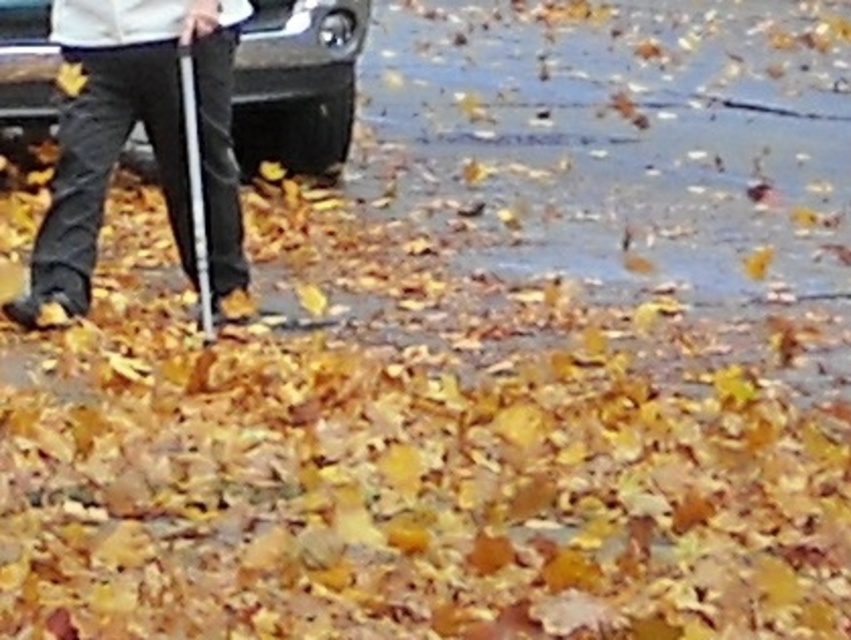
Question: Which of the following is the closest to the observer?

Choices:
 (A) black matte car at center
 (B) metallic silver crutch at left

Answer: (B)

Question: Can you confirm if dark gray pants at left is positioned to the right of black matte car at center?

Choices:
 (A) yes
 (B) no

Answer: (B)

Question: Does black matte car at center appear on the left side of metallic silver crutch at left?

Choices:
 (A) no
 (B) yes

Answer: (A)

Question: Considering the real-world distances, which object is farthest from the dark gray pants at left?

Choices:
 (A) black matte car at center
 (B) metallic silver crutch at left

Answer: (A)

Question: Which object is positioned closest to the dark gray pants at left?

Choices:
 (A) black matte car at center
 (B) metallic silver crutch at left

Answer: (B)

Question: Can you confirm if dark gray pants at left is positioned to the left of black matte car at center?

Choices:
 (A) no
 (B) yes

Answer: (B)